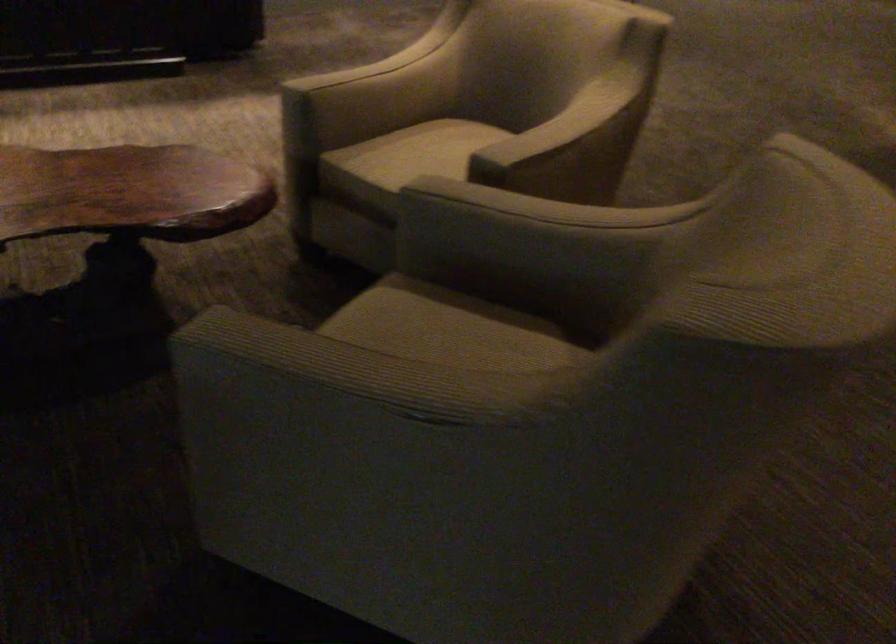
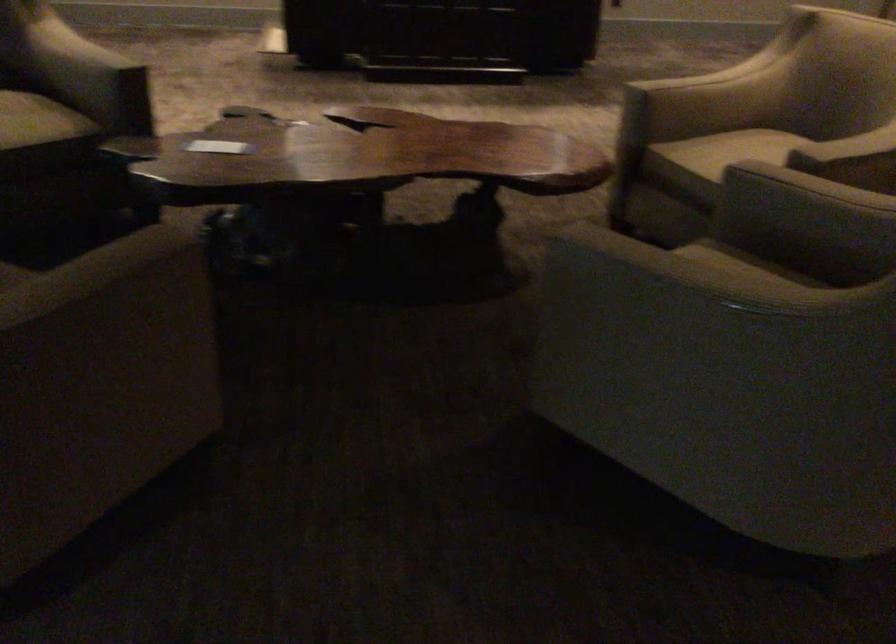
The point at (x=416, y=149) is marked in the first image. Where is the corresponding point in the second image?

(741, 149)